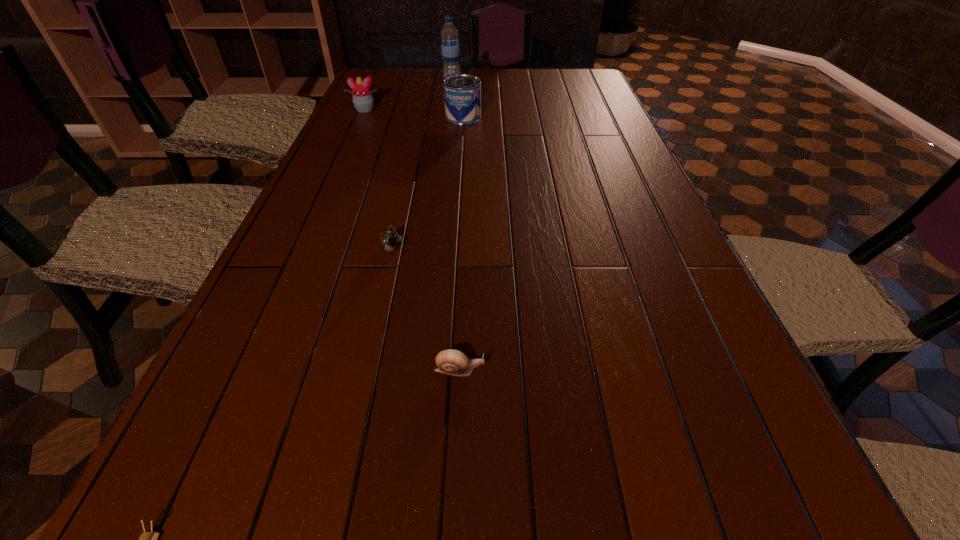
This screenshot has height=540, width=960. I want to click on vacant area in the image that satisfies the following two spatial constraints: 1. on the front label of the can; 2. on the face of the fourth tallest object, so click(454, 250).